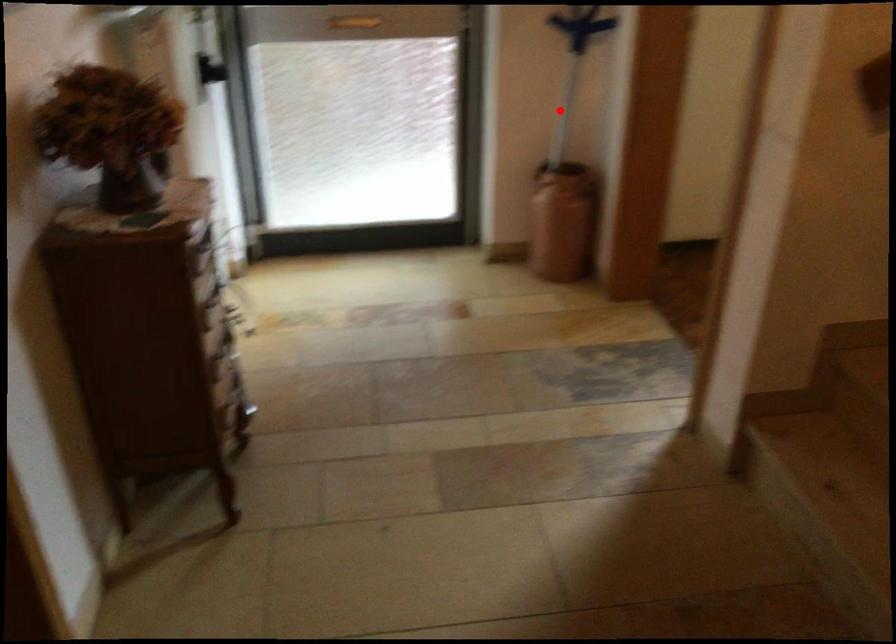
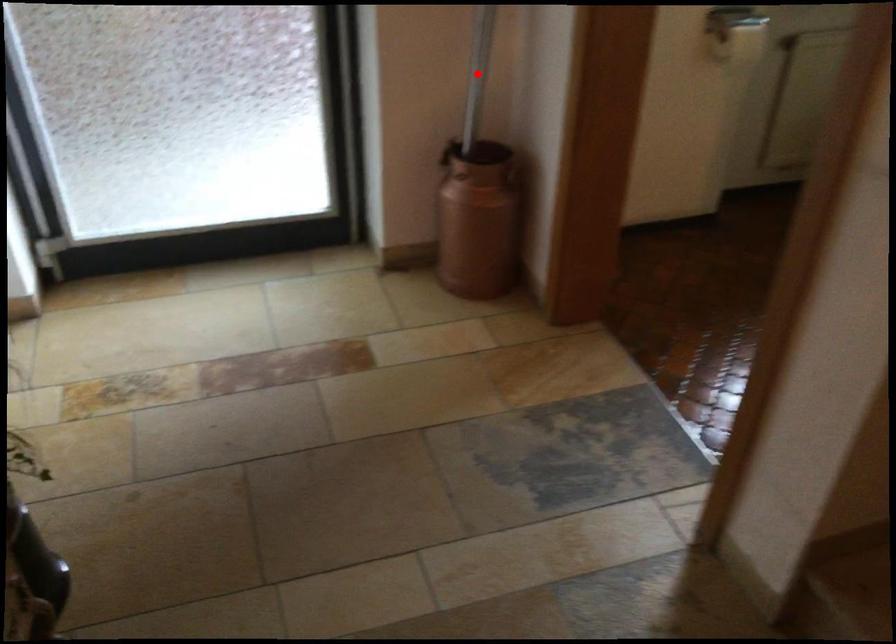
I am providing you with two images of the same scene from different viewpoints. A red point is marked on the first image and another point is marked on the second image. Is the marked point in image1 the same physical position as the marked point in image2?

Yes